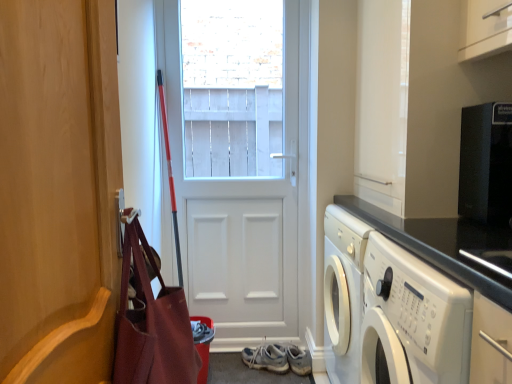
Question: In the image, is light blue fabric sneakers at center positioned in front of or behind black matte microwave at upper right?

Choices:
 (A) front
 (B) behind

Answer: (B)

Question: In terms of width, does light blue fabric sneakers at center look wider or thinner when compared to black matte microwave at upper right?

Choices:
 (A) wide
 (B) thin

Answer: (A)

Question: Estimate the real-world distances between objects in this image. Which object is closer to the wooden door at left, placed as the 1th door when sorted from front to back?

Choices:
 (A) light blue fabric sneakers at center
 (B) black matte microwave at upper right
 (C) white matte door at center, the 1th door in the back-to-front sequence
 (D) white glossy washing machine at lower right
 (E) leather-like brown bag at left

Answer: (E)

Question: Which of these objects is positioned farthest from the leather-like brown bag at left?

Choices:
 (A) white glossy washing machine at lower right
 (B) light blue fabric sneakers at center
 (C) black matte microwave at upper right
 (D) wooden door at left, placed as the 1th door when sorted from front to back
 (E) white matte door at center, acting as the 2th door starting from the front

Answer: (B)